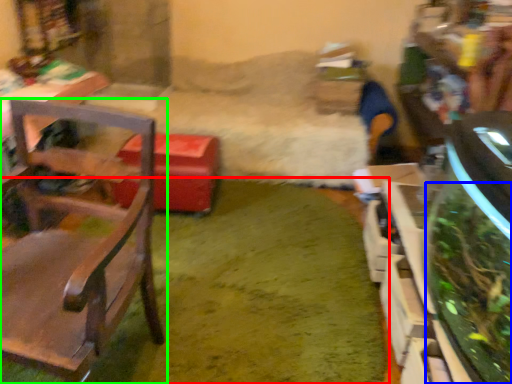
Question: Based on their relative distances, which object is nearer to grass (highlighted by a red box)? Choose from plant (highlighted by a blue box) and chair (highlighted by a green box).

Choices:
 (A) plant
 (B) chair

Answer: (B)